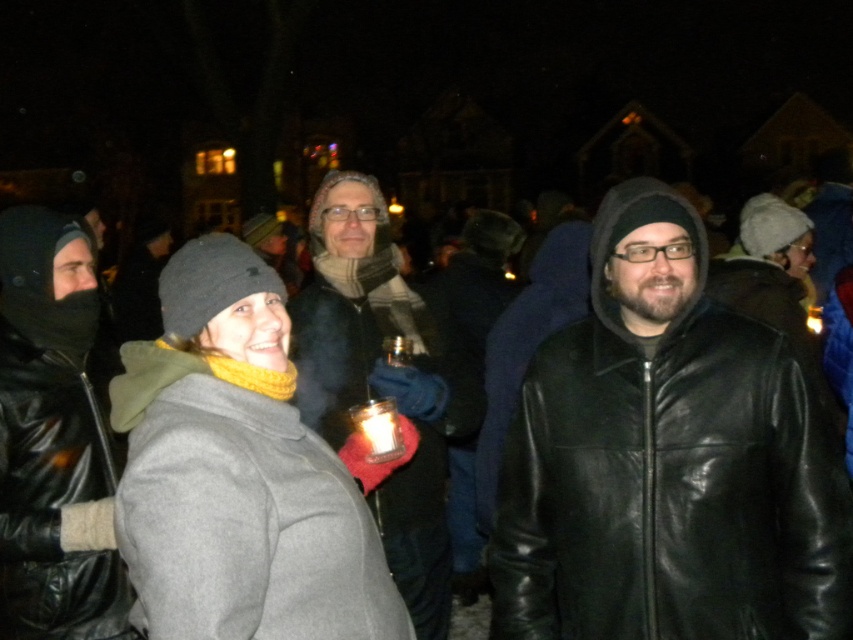
Question: Can you confirm if shiny black leather jacket at center is positioned above matte black jacket at center?

Choices:
 (A) no
 (B) yes

Answer: (B)

Question: Among these objects, which one is farthest from the camera?

Choices:
 (A) shiny black leather jacket at center
 (B) matte black jacket at center
 (C) black leather jacket at left

Answer: (B)

Question: Which object is farther from the camera taking this photo?

Choices:
 (A) matte black jacket at center
 (B) shiny black leather jacket at center
 (C) black leather jacket at left

Answer: (A)

Question: Which point is farther to the camera?

Choices:
 (A) (379, 388)
 (B) (42, 339)

Answer: (A)

Question: Can you confirm if shiny black leather jacket at center is smaller than black leather jacket at left?

Choices:
 (A) no
 (B) yes

Answer: (A)

Question: In this image, where is black leather jacket at left located relative to matte black jacket at center?

Choices:
 (A) left
 (B) right

Answer: (A)